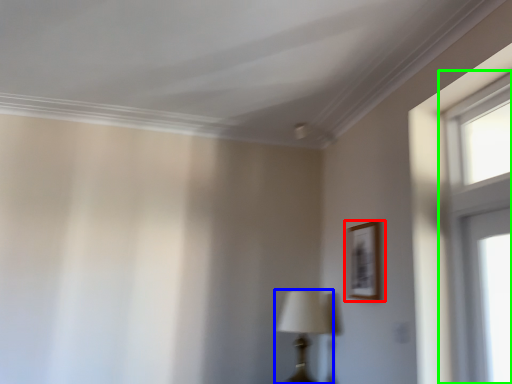
Question: Based on their relative distances, which object is farther from picture frame (highlighted by a red box)? Choose from table lamp (highlighted by a blue box) and window (highlighted by a green box).

Choices:
 (A) table lamp
 (B) window

Answer: (B)